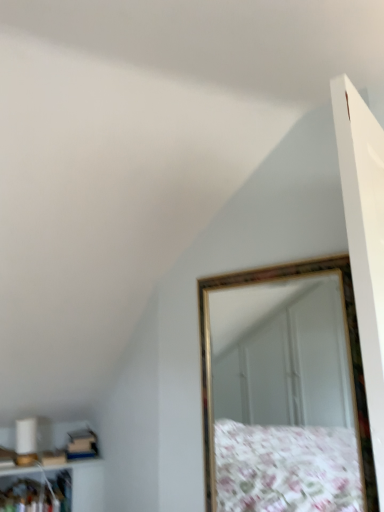
Identify the location of gold-framed mirror at upper right. (287, 411).

This screenshot has width=384, height=512. What do you see at coordinates (287, 411) in the screenshot?
I see `gold-framed mirror at upper right` at bounding box center [287, 411].

Based on the photo, measure the distance between gold-framed mirror at upper right and camera.

gold-framed mirror at upper right is 6.52 feet from camera.

This screenshot has height=512, width=384. What do you see at coordinates (38, 494) in the screenshot?
I see `white glossy cabinet at lower left` at bounding box center [38, 494].

The height and width of the screenshot is (512, 384). What are the coordinates of `white glossy cabinet at lower left` in the screenshot? It's located at (38, 494).

You are a GUI agent. You are given a task and a screenshot of the screen. Output one action in this format:
    pyautogui.click(x=<x>, y=<y>)
    Task: Click on the gold-framed mirror at upper right
    
    Given the screenshot: What is the action you would take?
    pyautogui.click(x=287, y=411)

Considering the positions of objects gold-framed mirror at upper right and white glossy cabinet at lower left in the image provided, who is more to the left, gold-framed mirror at upper right or white glossy cabinet at lower left?

white glossy cabinet at lower left.

Between gold-framed mirror at upper right and white glossy cabinet at lower left, which one is positioned in front?

gold-framed mirror at upper right is closer to the camera.

Between point (237, 443) and point (21, 495), which one is positioned behind?

Positioned behind is point (237, 443).

From the image's perspective, is gold-framed mirror at upper right located beneath white glossy cabinet at lower left?

No.

From a real-world perspective, which is physically below, gold-framed mirror at upper right or white glossy cabinet at lower left?

In real-world perspective, white glossy cabinet at lower left is lower.

Looking at their sizes, would you say gold-framed mirror at upper right is wider or thinner than white glossy cabinet at lower left?

Clearly, gold-framed mirror at upper right has less width compared to white glossy cabinet at lower left.

Is gold-framed mirror at upper right taller or shorter than white glossy cabinet at lower left?

gold-framed mirror at upper right is taller than white glossy cabinet at lower left.

Who is bigger, gold-framed mirror at upper right or white glossy cabinet at lower left?

With larger size is white glossy cabinet at lower left.

Is white glossy cabinet at lower left inside gold-framed mirror at upper right?

Definitely not — white glossy cabinet at lower left is not inside gold-framed mirror at upper right.

Is gold-framed mirror at upper right not close to white glossy cabinet at lower left?

gold-framed mirror at upper right is far away from white glossy cabinet at lower left.

Could you tell me if gold-framed mirror at upper right is facing white glossy cabinet at lower left?

No, gold-framed mirror at upper right is not oriented towards white glossy cabinet at lower left.

This screenshot has width=384, height=512. Identify the location of cabinet on the left of gold-framed mirror at upper right. (38, 494).

Is white glossy cabinet at lower left at the right side of gold-framed mirror at upper right?

Incorrect, white glossy cabinet at lower left is not on the right side of gold-framed mirror at upper right.

Is white glossy cabinet at lower left further to the viewer compared to gold-framed mirror at upper right?

Yes, white glossy cabinet at lower left is further from the camera.

Is point (28, 490) farther from viewer compared to point (228, 457)?

No.

From the image's perspective, which one is positioned lower, white glossy cabinet at lower left or gold-framed mirror at upper right?

white glossy cabinet at lower left is shown below in the image.

From a real-world perspective, is white glossy cabinet at lower left located higher than gold-framed mirror at upper right?

No, from a real-world perspective, white glossy cabinet at lower left is not over gold-framed mirror at upper right

Which object is wider, white glossy cabinet at lower left or gold-framed mirror at upper right?

white glossy cabinet at lower left.

Who is taller, white glossy cabinet at lower left or gold-framed mirror at upper right?

Standing taller between the two is gold-framed mirror at upper right.

Considering the sizes of white glossy cabinet at lower left and gold-framed mirror at upper right in the image, is white glossy cabinet at lower left bigger or smaller than gold-framed mirror at upper right?

white glossy cabinet at lower left is bigger than gold-framed mirror at upper right.

Is gold-framed mirror at upper right a part of white glossy cabinet at lower left?

No, gold-framed mirror at upper right is not inside white glossy cabinet at lower left.

Is the surface of white glossy cabinet at lower left in direct contact with gold-framed mirror at upper right?

There is a gap between white glossy cabinet at lower left and gold-framed mirror at upper right.

Could you tell me if white glossy cabinet at lower left is facing gold-framed mirror at upper right?

No, white glossy cabinet at lower left is not turned towards gold-framed mirror at upper right.

There is a white glossy cabinet at lower left. At what (x,y) coordinates should I click in order to perform the action: click on mirror above it (from a real-world perspective). Please return your answer as a coordinate pair (x, y). This screenshot has height=512, width=384. Looking at the image, I should click on (287, 411).

The height and width of the screenshot is (512, 384). I want to click on cabinet that appears on the left of gold-framed mirror at upper right, so click(x=38, y=494).

In order to click on cabinet below the gold-framed mirror at upper right (from the image's perspective) in this screenshot , I will do `click(38, 494)`.